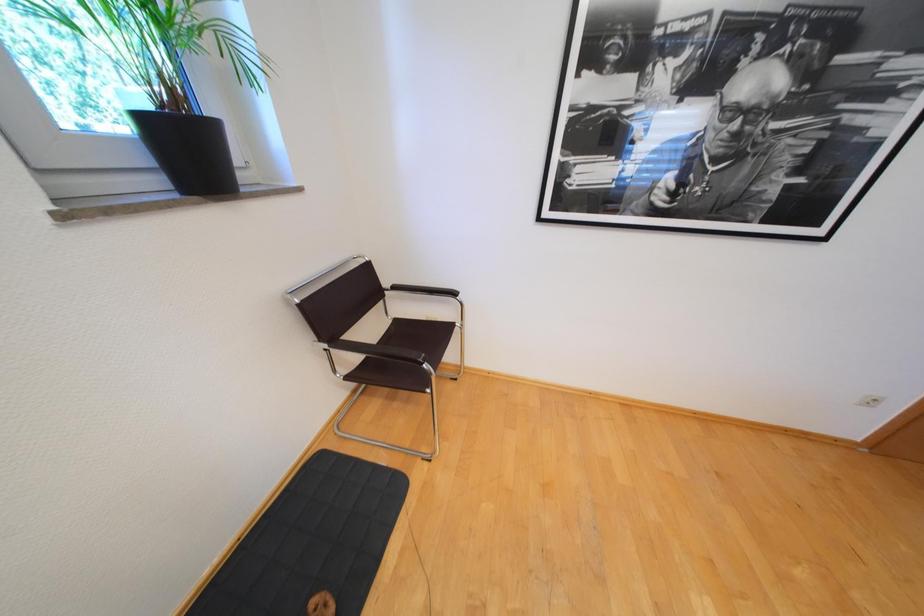
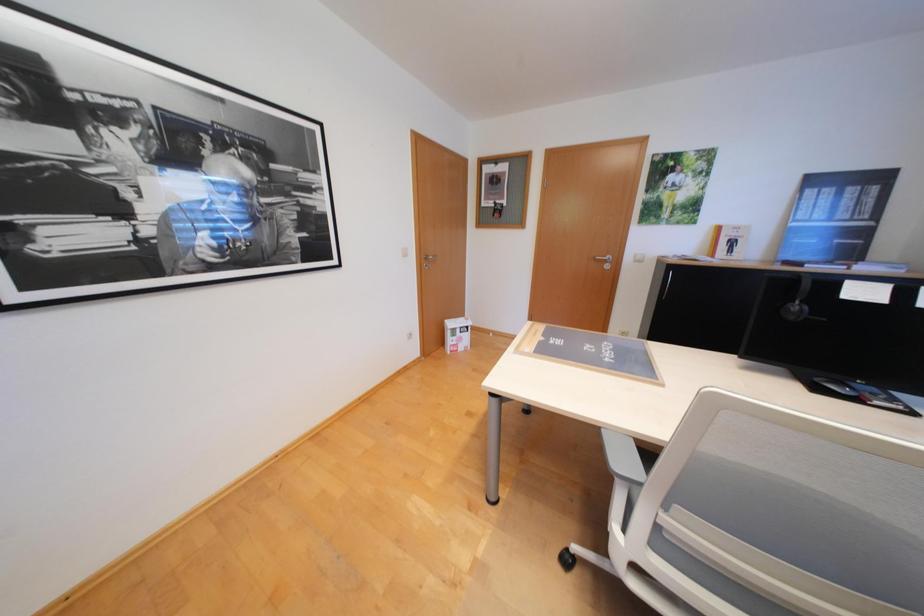
Question: Based on the continuous images, in which direction is the camera rotating? Reply with the corresponding letter.

Choices:
 (A) Left
 (B) Right
 (C) Up
 (D) Down

Answer: (B)